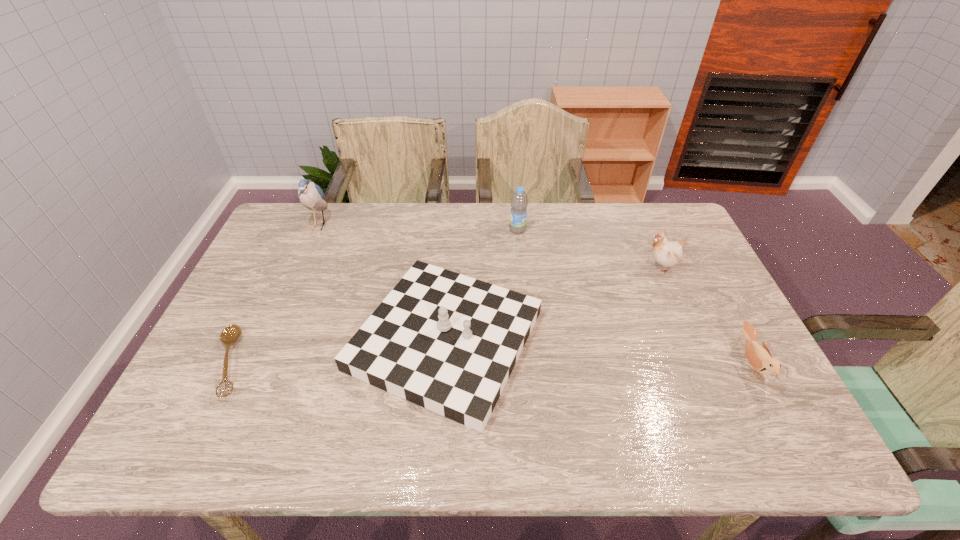
I want to click on vacant point located between the farthest bird and the second nearest bird, so click(x=490, y=246).

You are a GUI agent. You are given a task and a screenshot of the screen. Output one action in this format:
    pyautogui.click(x=<x>, y=<y>)
    Task: Click on the vacant space that is in between the tallest bird and the water bottle
    
    Given the screenshot: What is the action you would take?
    pyautogui.click(x=419, y=227)

Find the location of a particular element. Image resolution: width=960 pixels, height=540 pixels. empty space between the shortest object and the checkerboard is located at coordinates (338, 351).

Locate an element on the screen. The width and height of the screenshot is (960, 540). vacant space in between the ladle and the checkerboard is located at coordinates (338, 351).

The image size is (960, 540). What are the coordinates of `free space between the second shortest bird and the farthest bird` in the screenshot? It's located at (490, 246).

At what (x,y) coordinates should I click in order to perform the action: click on vacant space in between the shortest bird and the fifth object from left to right. Please return your answer as a coordinate pair (x, y). Looking at the image, I should click on (x=706, y=316).

Where is `vacant area that lies between the water bottle and the second tallest bird`? The height and width of the screenshot is (540, 960). vacant area that lies between the water bottle and the second tallest bird is located at coordinates (589, 248).

Locate an element on the screen. object that is the second closest to the second shortest object is located at coordinates (444, 341).

Select which object appears as the closest to the tallest bird. Please provide its 2D coordinates. Your answer should be formatted as a tuple, i.e. [(x, y)], where the tuple contains the x and y coordinates of a point satisfying the conditions above.

[(444, 341)]

Where is `the closest bird to the ladle`? This screenshot has width=960, height=540. the closest bird to the ladle is located at coordinates (311, 195).